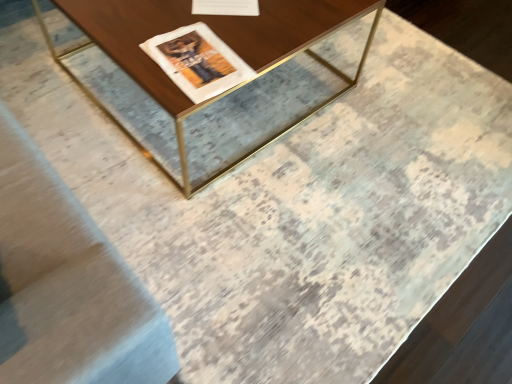
At what (x,y) coordinates should I click in order to perform the action: click on free space to the right of matte gold table at center. Please return your answer as a coordinate pair (x, y). This screenshot has width=512, height=384. Looking at the image, I should click on (392, 148).